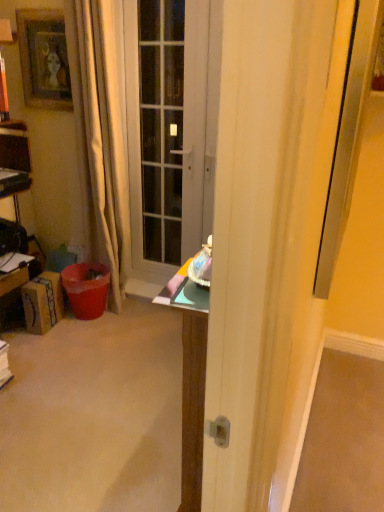
This screenshot has width=384, height=512. What do you see at coordinates (44, 59) in the screenshot? I see `wooden framed picture at upper left` at bounding box center [44, 59].

The image size is (384, 512). I want to click on wooden framed picture at upper left, so pyautogui.click(x=44, y=59).

The image size is (384, 512). I want to click on brushed metal drawer at left, so click(13, 280).

Which object is closer to the camera, matte gray door at center or brushed metal drawer at left?

matte gray door at center is in front.

Does matte gray door at center have a lesser height compared to brushed metal drawer at left?

No.

Is matte gray door at center bigger than brushed metal drawer at left?

Yes, matte gray door at center is bigger than brushed metal drawer at left.

From the image's perspective, is matte gray door at center located above or below beige fabric curtain at left?

matte gray door at center is situated higher than beige fabric curtain at left in the image.

Based on the photo, is matte gray door at center positioned with its back to beige fabric curtain at left?

No, matte gray door at center is not facing away from beige fabric curtain at left.

Is point (186, 189) less distant than point (111, 153)?

No, (186, 189) is behind (111, 153).

Between point (108, 229) and point (65, 106), which one is positioned in front?

The point (65, 106) is more forward.

Considering the sizes of objects beige fabric curtain at left and wooden framed picture at upper left in the image provided, who is shorter, beige fabric curtain at left or wooden framed picture at upper left?

Standing shorter between the two is wooden framed picture at upper left.

From the image's perspective, is beige fabric curtain at left above or below wooden framed picture at upper left?

Clearly, from the image's perspective, beige fabric curtain at left is below wooden framed picture at upper left.

Could you tell me if beige fabric curtain at left is facing wooden framed picture at upper left?

No, beige fabric curtain at left is not turned towards wooden framed picture at upper left.

From a real-world perspective, is beige fabric curtain at left physically located above or below brushed metal drawer at left?

beige fabric curtain at left is above brushed metal drawer at left.

Is beige fabric curtain at left wider than brushed metal drawer at left?

Yes, beige fabric curtain at left is wider than brushed metal drawer at left.

Which point is more forward, (90, 148) or (6, 283)?

Positioned in front is point (90, 148).

Is beige fabric curtain at left positioned with its back to brushed metal drawer at left?

That's not correct — beige fabric curtain at left is not looking away from brushed metal drawer at left.

Between brushed metal drawer at left and matte gray door at center, which one has less height?

brushed metal drawer at left is shorter.

Does brushed metal drawer at left contain matte gray door at center?

No, matte gray door at center is not a part of brushed metal drawer at left.

Which is more to the right, brushed metal drawer at left or matte gray door at center?

matte gray door at center.

Which of these two, brushed metal drawer at left or matte gray door at center, is wider?

Wider between the two is brushed metal drawer at left.

Is beige fabric curtain at left facing away from matte gray door at center?

beige fabric curtain at left does not have its back to matte gray door at center.

Does point (97, 56) come farther from viewer compared to point (192, 32)?

No, it is in front of (192, 32).

Is matte gray door at center inside beige fabric curtain at left?

No, matte gray door at center is not inside beige fabric curtain at left.

Is wooden framed picture at upper left turned away from matte gray door at center?

No, wooden framed picture at upper left is not facing the opposite direction of matte gray door at center.

Is wooden framed picture at upper left taller or shorter than matte gray door at center?

In the image, wooden framed picture at upper left appears to be shorter than matte gray door at center.

Identify the location of door below the wooden framed picture at upper left (from a real-world perspective). (170, 129).

From a real-world perspective, who is located lower, wooden framed picture at upper left or matte gray door at center?

matte gray door at center, from a real-world perspective.

This screenshot has height=512, width=384. Find the location of `door above the brushed metal drawer at left (from a real-world perspective)`. door above the brushed metal drawer at left (from a real-world perspective) is located at coordinates (170, 129).

This screenshot has height=512, width=384. In order to click on curtain in front of the matte gray door at center in this screenshot , I will do `click(99, 138)`.

When comparing their distances from beige fabric curtain at left, does matte gray door at center or brushed metal drawer at left seem further?

brushed metal drawer at left is positioned further to the anchor beige fabric curtain at left.

From the image, which object appears to be nearer to wooden framed picture at upper left, matte gray door at center or beige fabric curtain at left?

beige fabric curtain at left is positioned closer to the anchor wooden framed picture at upper left.

Considering their positions, is wooden framed picture at upper left positioned further to brushed metal drawer at left than beige fabric curtain at left?

Based on the image, wooden framed picture at upper left appears to be further to brushed metal drawer at left.

Based on their spatial positions, is matte gray door at center or brushed metal drawer at left further from wooden framed picture at upper left?

Among the two, brushed metal drawer at left is located further to wooden framed picture at upper left.

When comparing their distances from wooden framed picture at upper left, does beige fabric curtain at left or matte gray door at center seem closer?

beige fabric curtain at left.

Looking at the image, which one is located further to matte gray door at center, wooden framed picture at upper left or beige fabric curtain at left?

wooden framed picture at upper left.

Considering their positions, is wooden framed picture at upper left positioned closer to beige fabric curtain at left than brushed metal drawer at left?

Based on the image, wooden framed picture at upper left appears to be nearer to beige fabric curtain at left.

When comparing their distances from wooden framed picture at upper left, does brushed metal drawer at left or matte gray door at center seem closer?

matte gray door at center is closer to wooden framed picture at upper left.

Find the location of a particular element. door between wooden framed picture at upper left and brushed metal drawer at left from top to bottom is located at coordinates (170, 129).

Identify the location of curtain between brushed metal drawer at left and matte gray door at center in the horizontal direction. The width and height of the screenshot is (384, 512). (99, 138).

Find the location of a particular element. This screenshot has width=384, height=512. curtain between wooden framed picture at upper left and matte gray door at center is located at coordinates (99, 138).

I want to click on curtain between wooden framed picture at upper left and brushed metal drawer at left in the vertical direction, so click(99, 138).